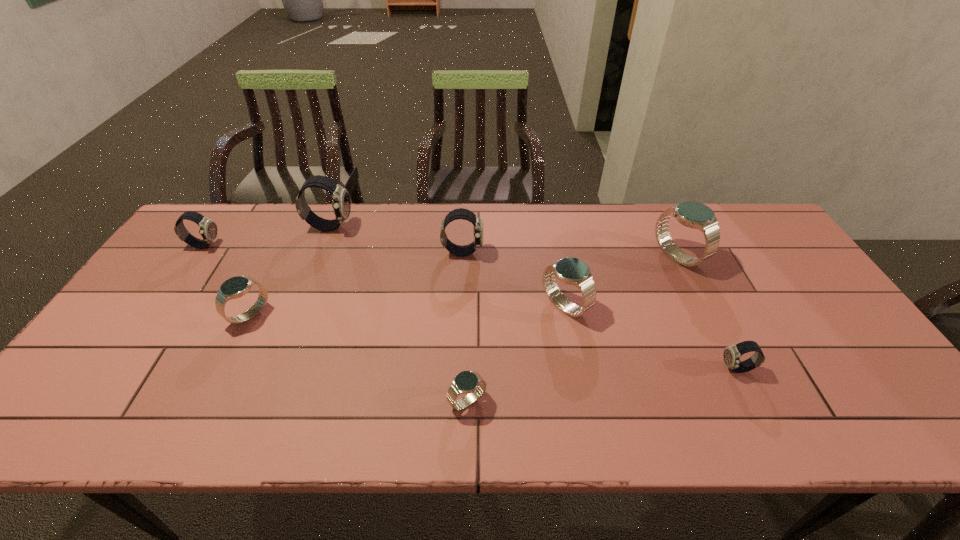
In the image, there is a desktop. Where is `vacant region at the right edge`? This screenshot has height=540, width=960. vacant region at the right edge is located at coordinates (782, 326).

You are a GUI agent. You are given a task and a screenshot of the screen. Output one action in this format:
    pyautogui.click(x=<x>, y=<y>)
    Task: Click on the free location at the far left corner of the desktop
    
    Given the screenshot: What is the action you would take?
    pyautogui.click(x=225, y=203)

The width and height of the screenshot is (960, 540). Find the location of `unoccupied position between the leftmost watch and the rightmost blue watch`. unoccupied position between the leftmost watch and the rightmost blue watch is located at coordinates (441, 251).

Locate an element on the screen. free space that is in between the farthest blue watch and the third biggest dark watch is located at coordinates 441,251.

In order to click on free space between the third dark watch from left to right and the farthest object in this screenshot , I will do pos(396,239).

This screenshot has width=960, height=540. In order to click on unoccupied position between the third smallest blue watch and the second dark watch from right to left in this screenshot , I will do `click(514, 279)`.

The image size is (960, 540). I want to click on vacant area between the third dark watch from left to right and the smallest blue watch, so click(x=465, y=327).

You are a GUI agent. You are given a task and a screenshot of the screen. Output one action in this format:
    pyautogui.click(x=<x>, y=<y>)
    Task: Click on the vacant area that lies between the second biggest blue watch and the second smallest blue watch
    
    Given the screenshot: What is the action you would take?
    pyautogui.click(x=407, y=310)

This screenshot has width=960, height=540. I want to click on vacant space that's between the rightmost blue watch and the sixth watch from left to right, so click(x=621, y=281).

In order to click on unoccupied area between the third dark watch from left to right and the second blue watch from left to right in this screenshot , I will do `click(465, 327)`.